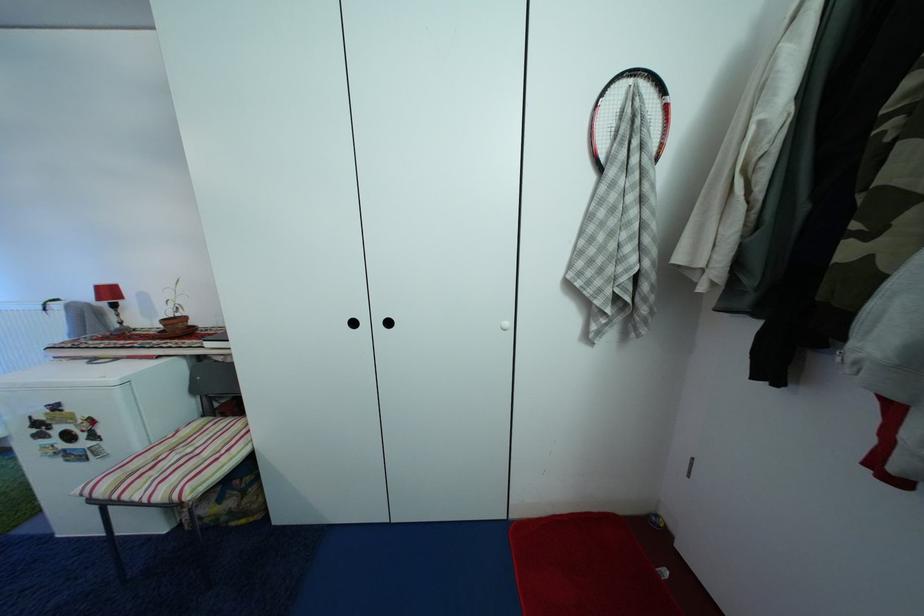
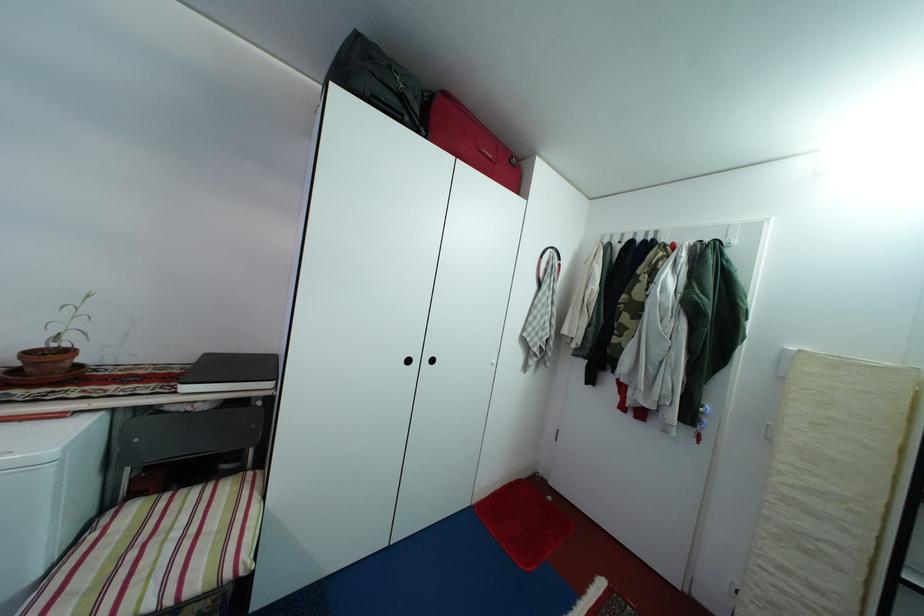
The point at (148,456) is marked in the first image. Where is the corresponding point in the second image?

(47, 581)